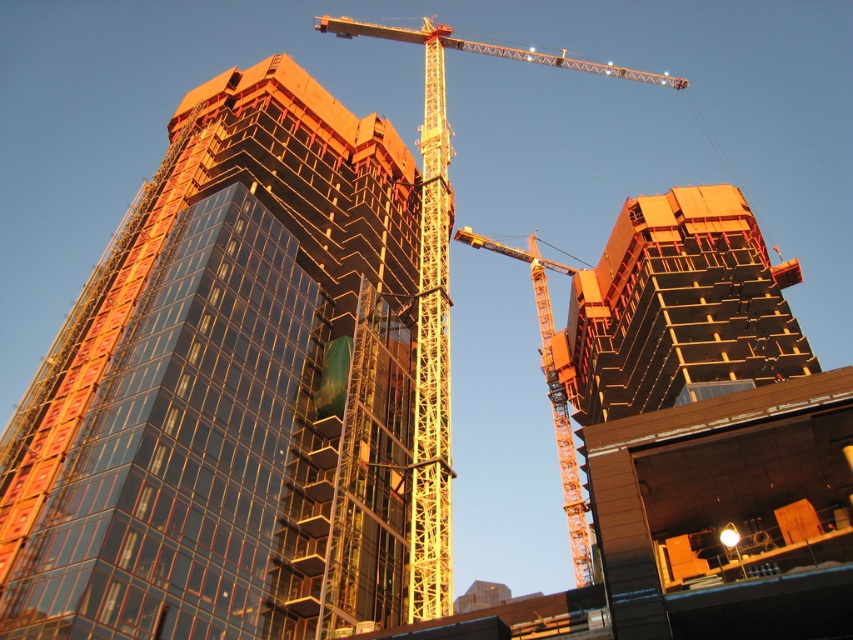
Question: Which object is the closest to the orange concrete building at right?

Choices:
 (A) yellow metallic crane at center
 (B) orange metallic crane at center
 (C) glassy reflective building at center

Answer: (B)

Question: Which of these objects is positioned farthest from the orange metallic crane at center?

Choices:
 (A) orange concrete building at right
 (B) yellow metallic crane at center
 (C) glassy reflective building at center

Answer: (C)

Question: Which point appears closest to the camera in this image?

Choices:
 (A) (350, 24)
 (B) (144, 538)

Answer: (B)

Question: From the image, what is the correct spatial relationship of orange concrete building at right in relation to yellow metallic crane at center?

Choices:
 (A) right
 (B) left

Answer: (A)

Question: Considering the relative positions of yellow metallic crane at center and orange metallic crane at center in the image provided, where is yellow metallic crane at center located with respect to orange metallic crane at center?

Choices:
 (A) right
 (B) left

Answer: (B)

Question: Can you confirm if orange concrete building at right is positioned below orange metallic crane at center?

Choices:
 (A) yes
 (B) no

Answer: (A)